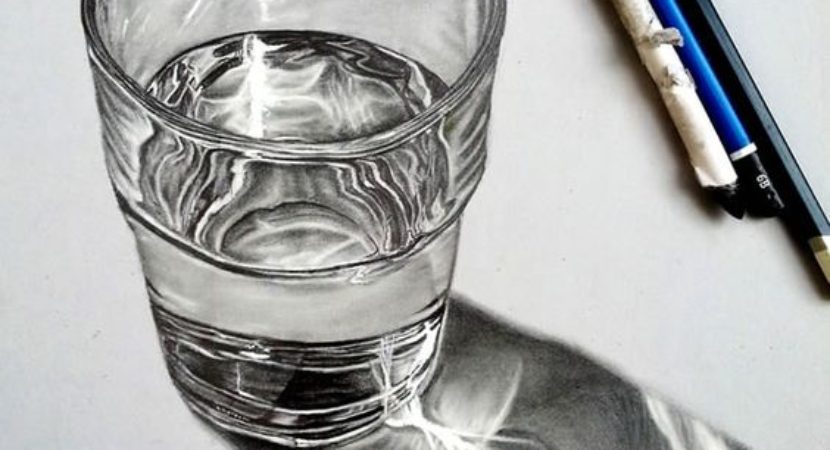
The height and width of the screenshot is (450, 830). In order to click on pen in this screenshot , I will do `click(733, 136)`.